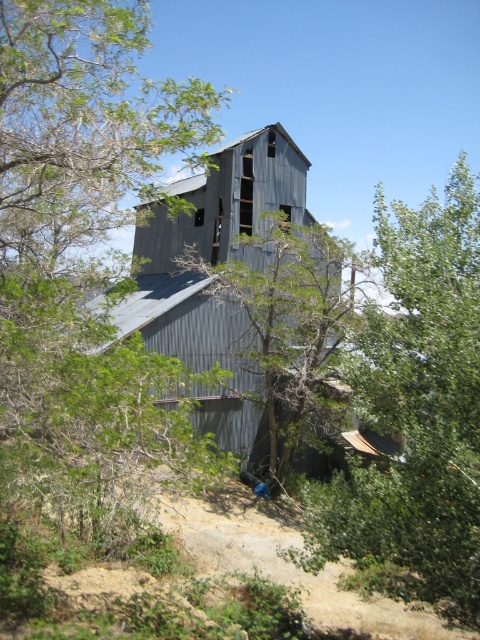
Question: Can you confirm if green leafy tree at right is smaller than green leafy tree at center?

Choices:
 (A) yes
 (B) no

Answer: (B)

Question: Which of the following is the farthest from the observer?

Choices:
 (A) (182, 324)
 (B) (370, 326)
 (C) (277, 326)

Answer: (A)

Question: Based on their relative distances, which object is farther from the rusty corrugated metal barn at center?

Choices:
 (A) green leafy tree at center
 (B) green leafy tree at right

Answer: (B)

Question: Can you confirm if green leafy tree at right is positioned above green leafy tree at center?

Choices:
 (A) yes
 (B) no

Answer: (A)

Question: Can you confirm if rusty corrugated metal barn at center is smaller than green leafy tree at center?

Choices:
 (A) no
 (B) yes

Answer: (A)

Question: Which point appears closest to the camera in this image?

Choices:
 (A) (317, 355)
 (B) (431, 548)

Answer: (B)